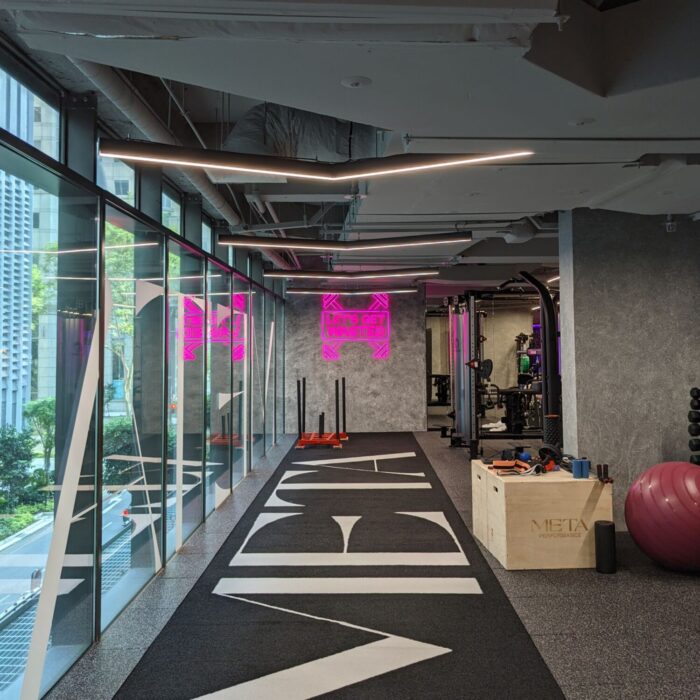
Locate an element on the screen. marble patterened gray walls is located at coordinates (638, 301), (386, 390).